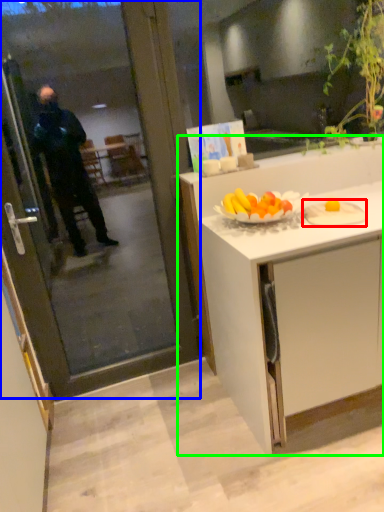
Question: Considering the real-world distances, which object is closest to plate (highlighted by a red box)? screen door (highlighted by a blue box) or cabinetry (highlighted by a green box).

Choices:
 (A) screen door
 (B) cabinetry

Answer: (B)